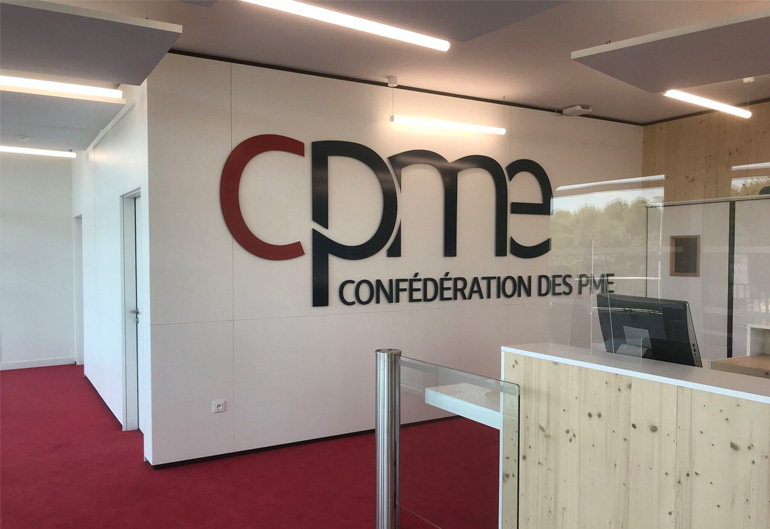
Identify the location of 1 computer. This screenshot has width=770, height=529. (684, 336).